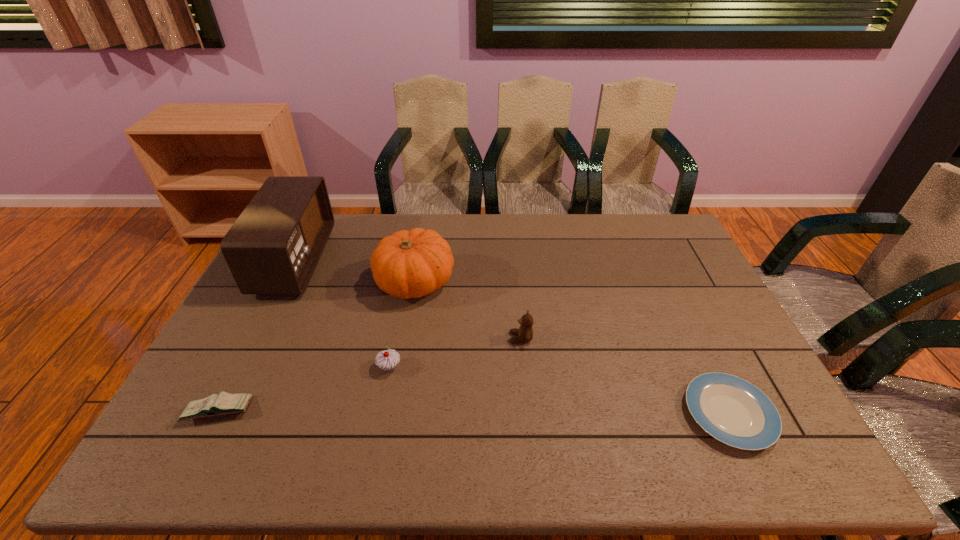
Image resolution: width=960 pixels, height=540 pixels. I want to click on radio receiver, so point(274,246).

Locate an element on the screen. This screenshot has height=540, width=960. the second tallest object is located at coordinates (408, 264).

Locate an element on the screen. the fourth farthest object is located at coordinates (387, 360).

Locate an element on the screen. the fourth nearest object is located at coordinates (525, 332).

At what (x,y) coordinates should I click in order to perform the action: click on teddy bear. Please return your answer as a coordinate pair (x, y). Image resolution: width=960 pixels, height=540 pixels. Looking at the image, I should click on click(525, 332).

At what (x,y) coordinates should I click in order to perform the action: click on diary. Please return your answer as a coordinate pair (x, y). The image size is (960, 540). Looking at the image, I should click on (225, 403).

Where is `the rightmost object`? This screenshot has width=960, height=540. the rightmost object is located at coordinates (732, 410).

Locate an element on the screen. The width and height of the screenshot is (960, 540). the shortest object is located at coordinates (732, 410).

Find the location of a particular element. Image resolution: width=960 pixels, height=540 pixels. vacant region located on the front-facing side of the tallest object is located at coordinates (348, 261).

The width and height of the screenshot is (960, 540). I want to click on free space located 0.330m on the right of the pumpkin, so click(556, 283).